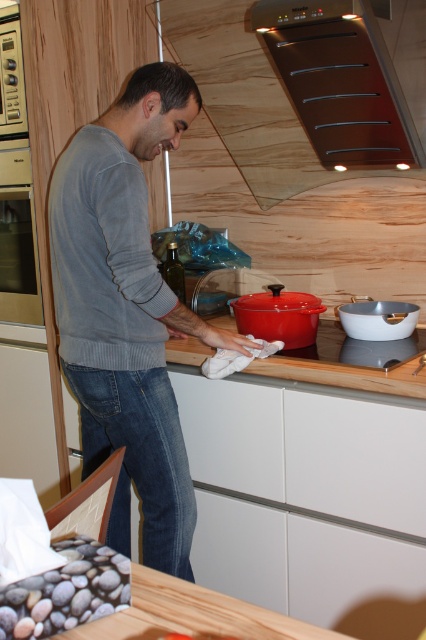
Which is below, wooden cutting board at center or matte stainless steel oven at left?

wooden cutting board at center is lower down.

Can you confirm if wooden cutting board at center is positioned to the left of matte stainless steel oven at left?

In fact, wooden cutting board at center is to the right of matte stainless steel oven at left.

Describe the element at coordinates (351, 364) in the screenshot. I see `wooden cutting board at center` at that location.

The height and width of the screenshot is (640, 426). I want to click on wooden cutting board at center, so pyautogui.click(x=351, y=364).

Does point (163, 424) come farther from viewer compared to point (322, 374)?

That is True.

Who is shorter, gray sweater at center or wooden cutting board at center?

Standing shorter between the two is wooden cutting board at center.

Who is more forward, (x=152, y=506) or (x=403, y=396)?

Positioned in front is point (x=403, y=396).

Where is `gray sweater at center`? gray sweater at center is located at coordinates (126, 310).

Measure the distance between brushed metal exhaust hood at upper center and wooden cutting board at center.

A distance of 31.61 inches exists between brushed metal exhaust hood at upper center and wooden cutting board at center.

Looking at this image, between brushed metal exhaust hood at upper center and wooden cutting board at center, which one is positioned lower?

wooden cutting board at center

Does point (276, 51) come closer to viewer compared to point (379, 362)?

That is False.

The height and width of the screenshot is (640, 426). Identify the location of brushed metal exhaust hood at upper center. (294, 96).